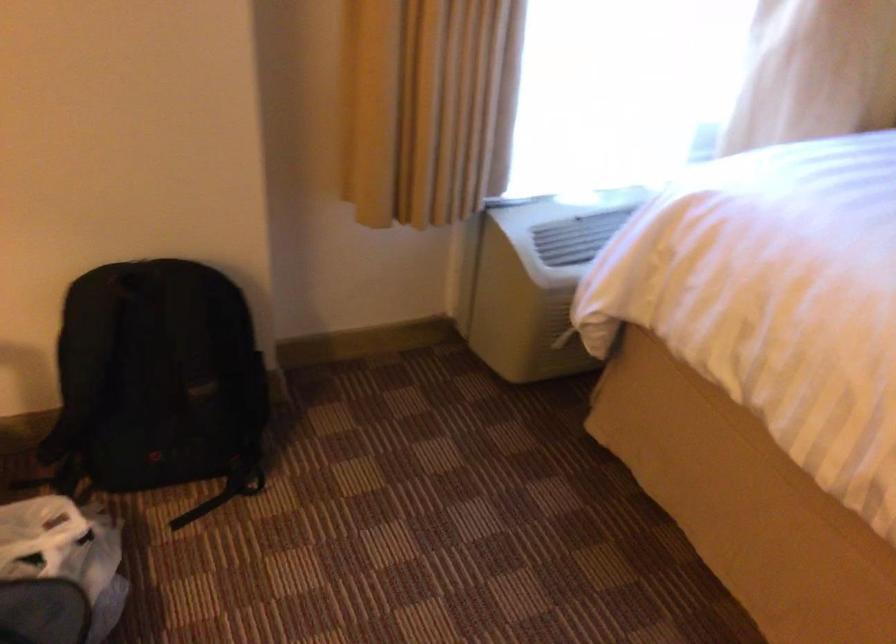
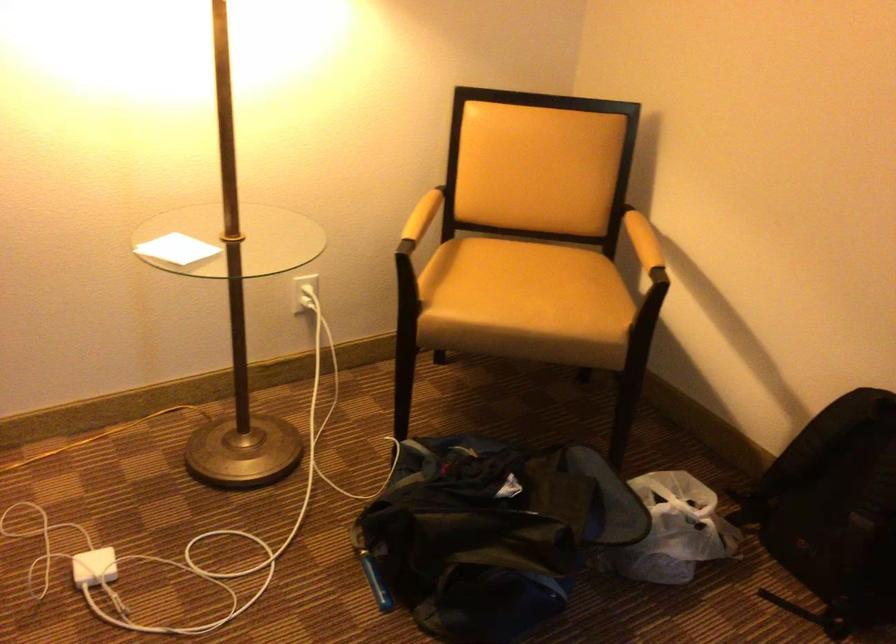
Question: The images are taken continuously from a first-person perspective. In which direction is your viewpoint rotating?

Choices:
 (A) Left
 (B) Right
 (C) Up
 (D) Down

Answer: (A)